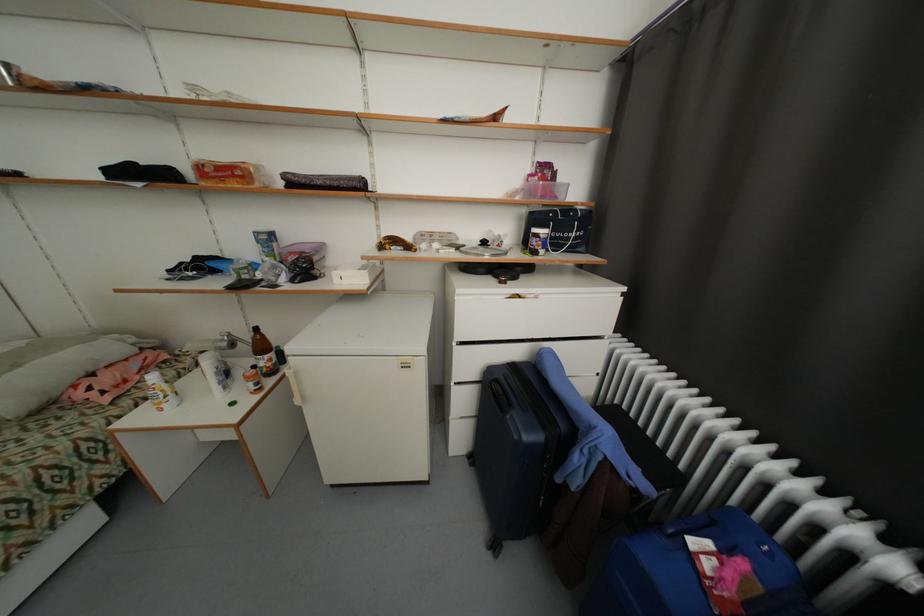
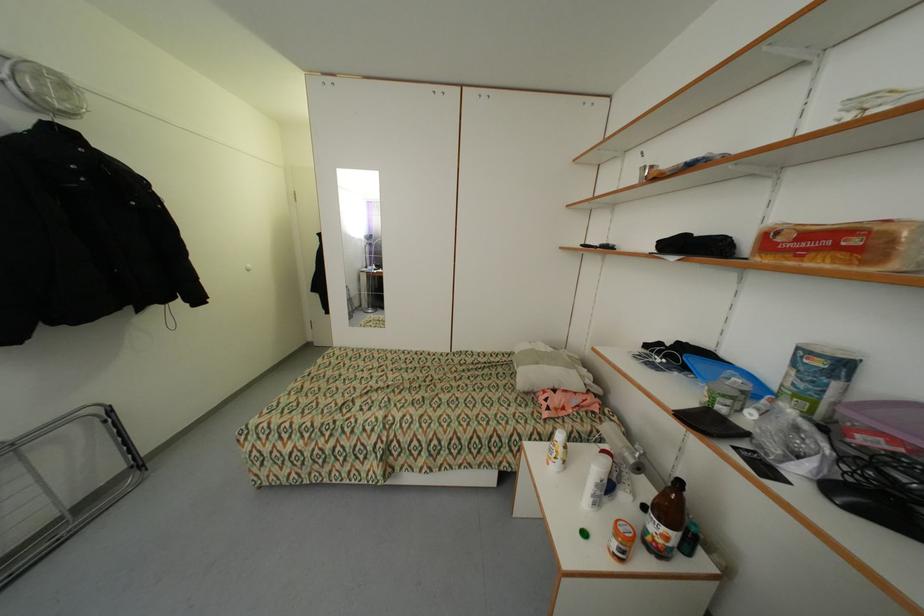
Where in the second image is the point corresponding to [262,385] from the first image?

(627, 552)